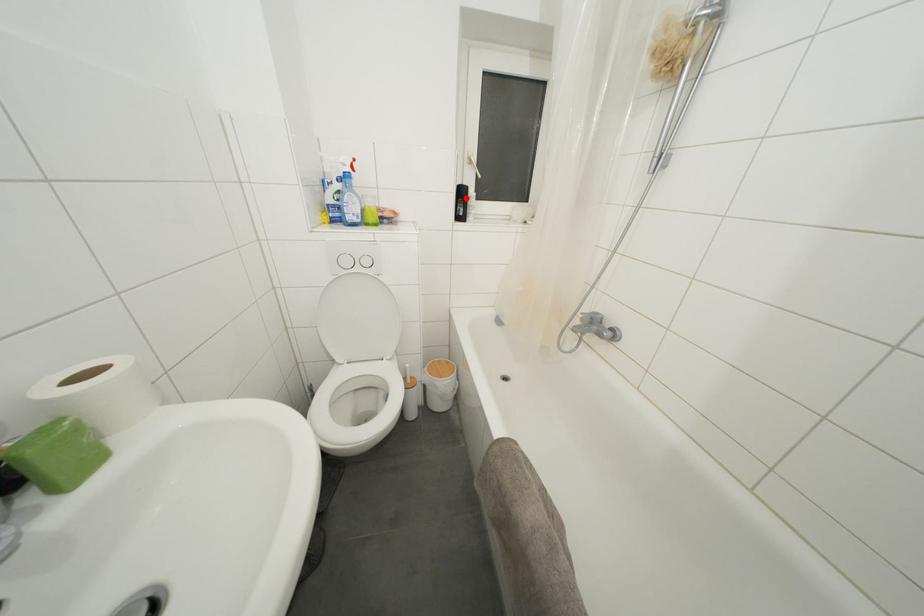
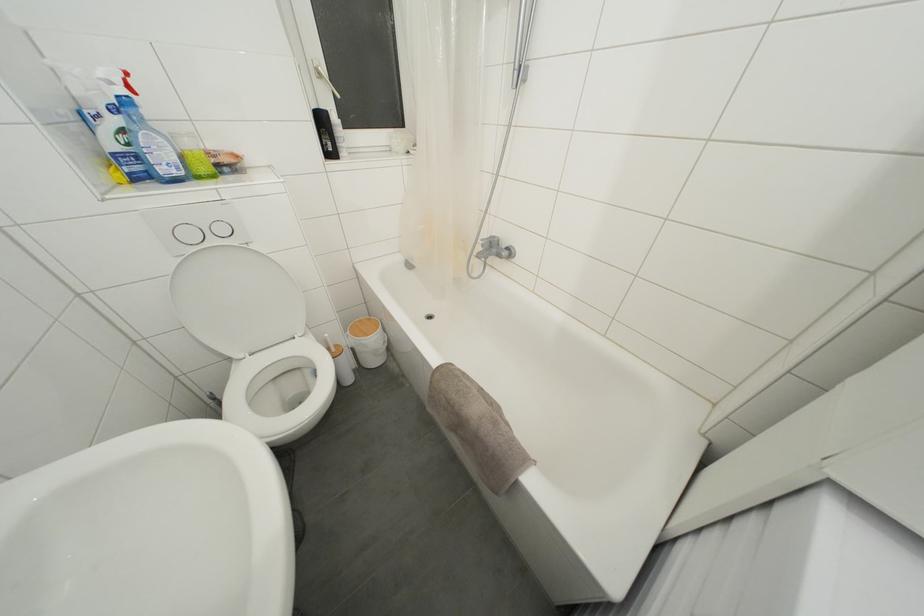
Find the pixel in the second image that matches the highlighted location in the first image.

(325, 126)